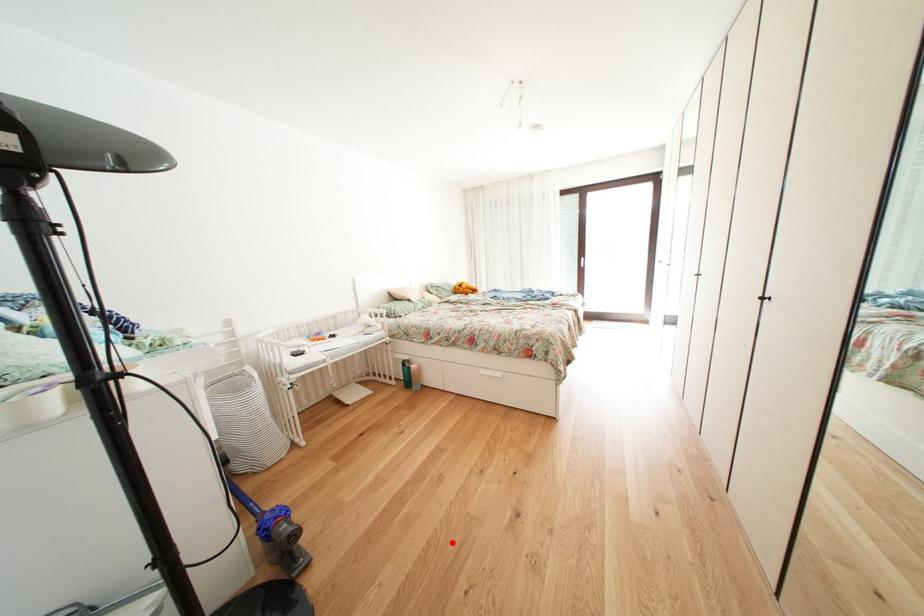
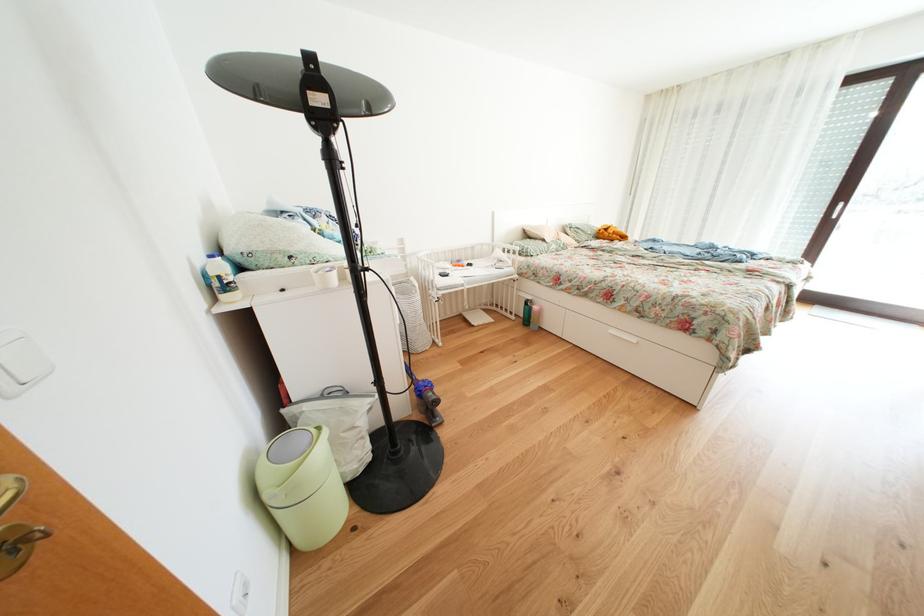
The point at the highlighted location is marked in the first image. Where is the corresponding point in the second image?

(550, 459)